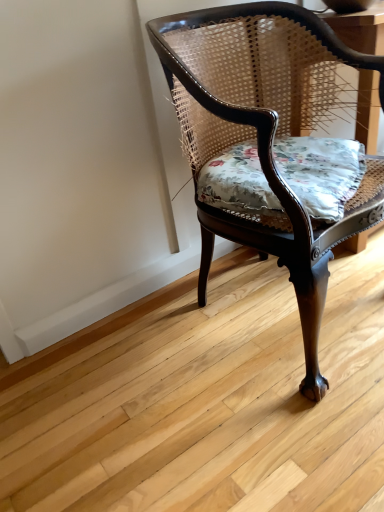
Question: Would you say floral fabric cushion at center is to the left or to the right of mahogany cane chair at center in the picture?

Choices:
 (A) left
 (B) right

Answer: (B)

Question: Is floral fabric cushion at center inside the boundaries of mahogany cane chair at center, or outside?

Choices:
 (A) inside
 (B) outside

Answer: (A)

Question: Is point (238, 146) positioned closer to the camera than point (195, 193)?

Choices:
 (A) closer
 (B) farther

Answer: (B)

Question: Is mahogany cane chair at center taller or shorter than floral fabric cushion at center?

Choices:
 (A) tall
 (B) short

Answer: (A)

Question: Considering the positions of mahogany cane chair at center and floral fabric cushion at center in the image, is mahogany cane chair at center wider or thinner than floral fabric cushion at center?

Choices:
 (A) wide
 (B) thin

Answer: (A)

Question: From the image's perspective, relative to floral fabric cushion at center, is mahogany cane chair at center above or below?

Choices:
 (A) above
 (B) below

Answer: (B)

Question: Based on their sizes in the image, would you say mahogany cane chair at center is bigger or smaller than floral fabric cushion at center?

Choices:
 (A) small
 (B) big

Answer: (B)